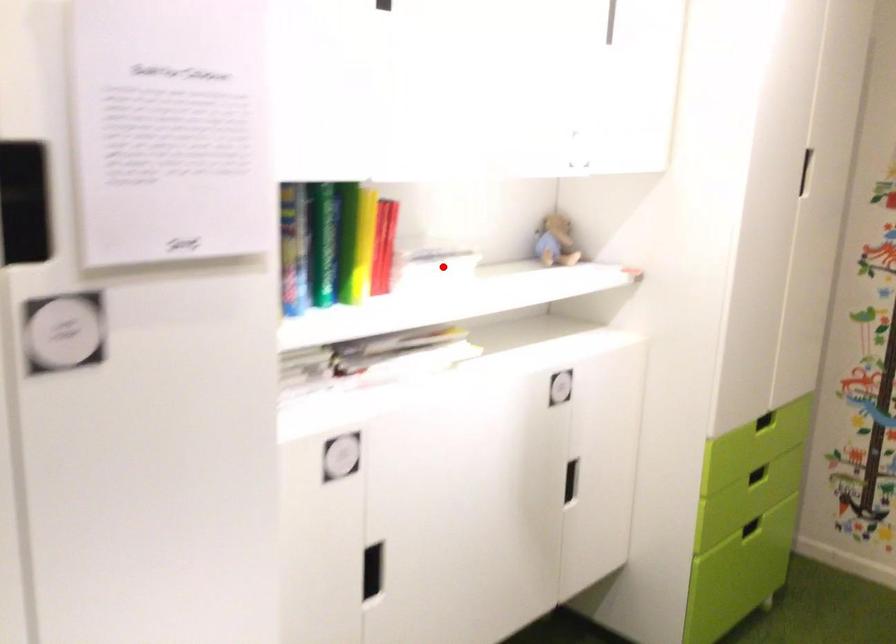
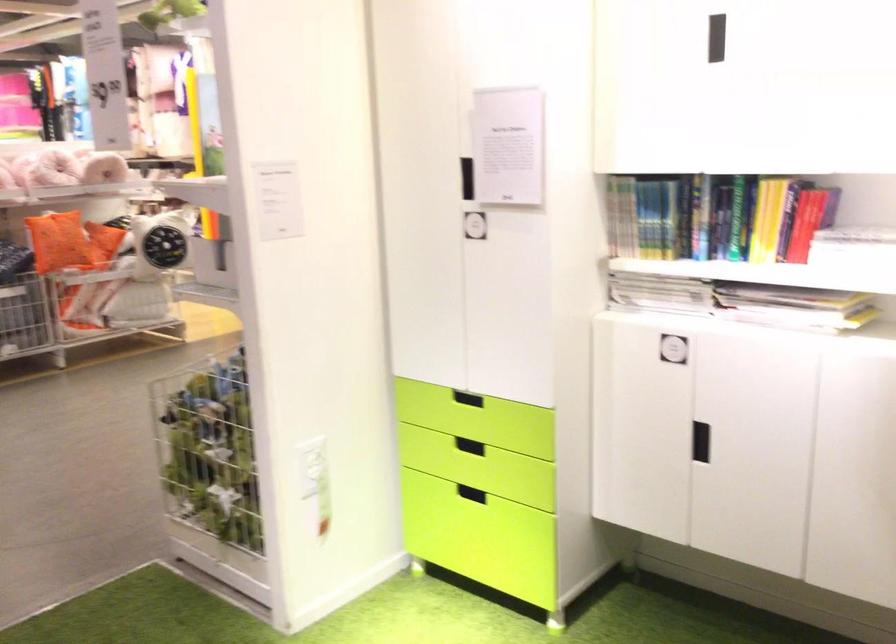
The point at the highlighted location is marked in the first image. Where is the corresponding point in the second image?

(853, 245)